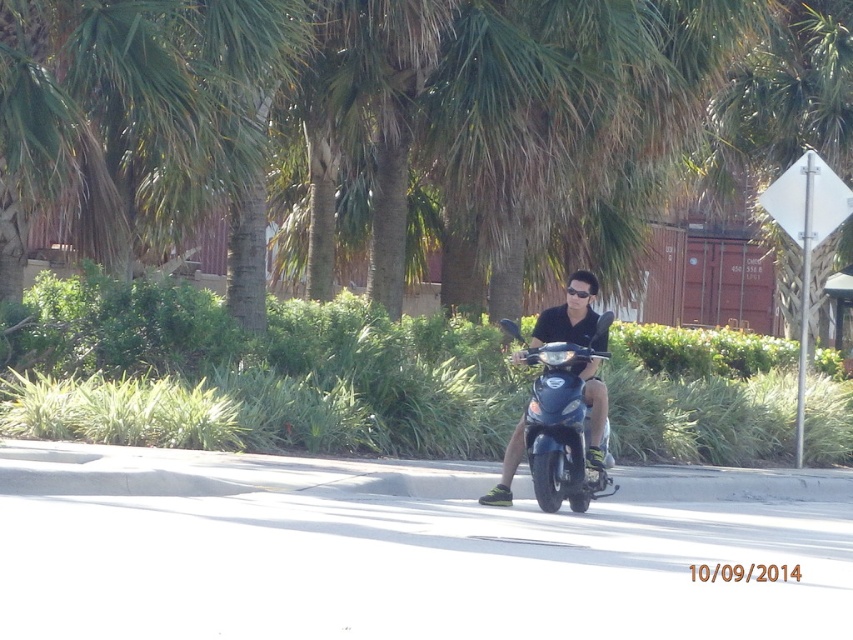
Which of these two, green leafy tree at center or glossy blue scooter at center, stands taller?

With more height is green leafy tree at center.

Does green leafy tree at center have a lesser width compared to glossy blue scooter at center?

No, green leafy tree at center is not thinner than glossy blue scooter at center.

This screenshot has width=853, height=640. What are the coordinates of `green leafy tree at center` in the screenshot? It's located at (572, 102).